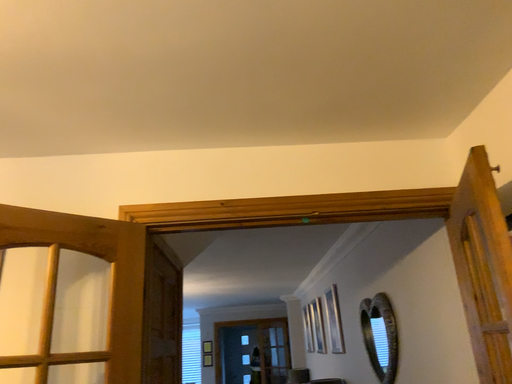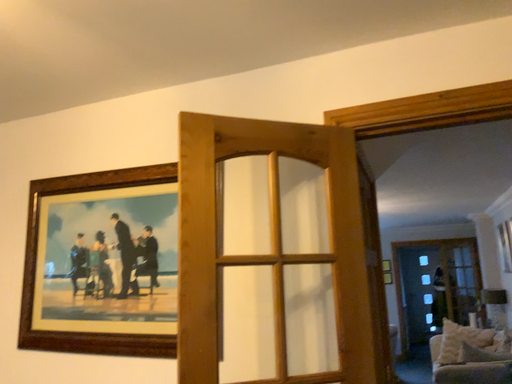
Question: Which way did the camera rotate in the video?

Choices:
 (A) rotated left
 (B) rotated right

Answer: (A)